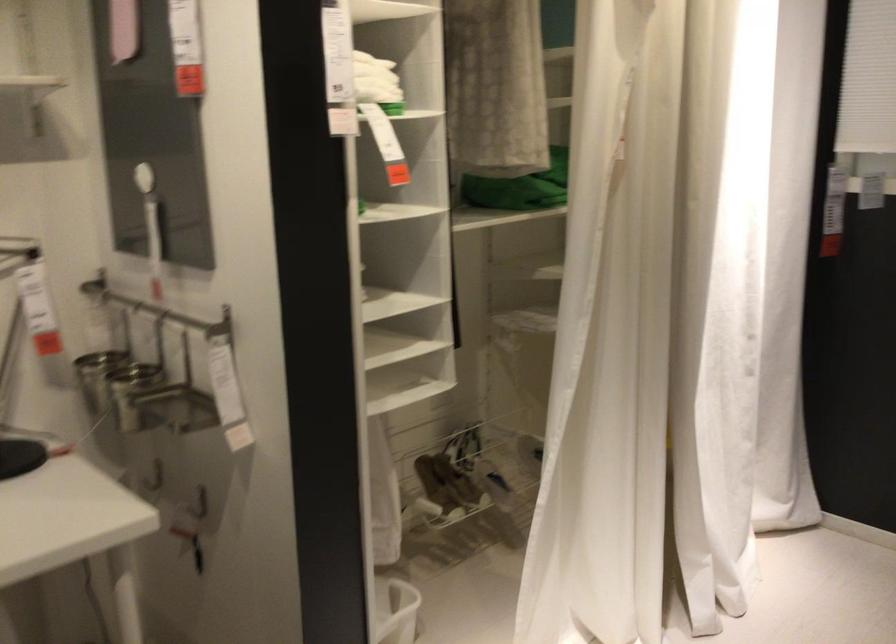
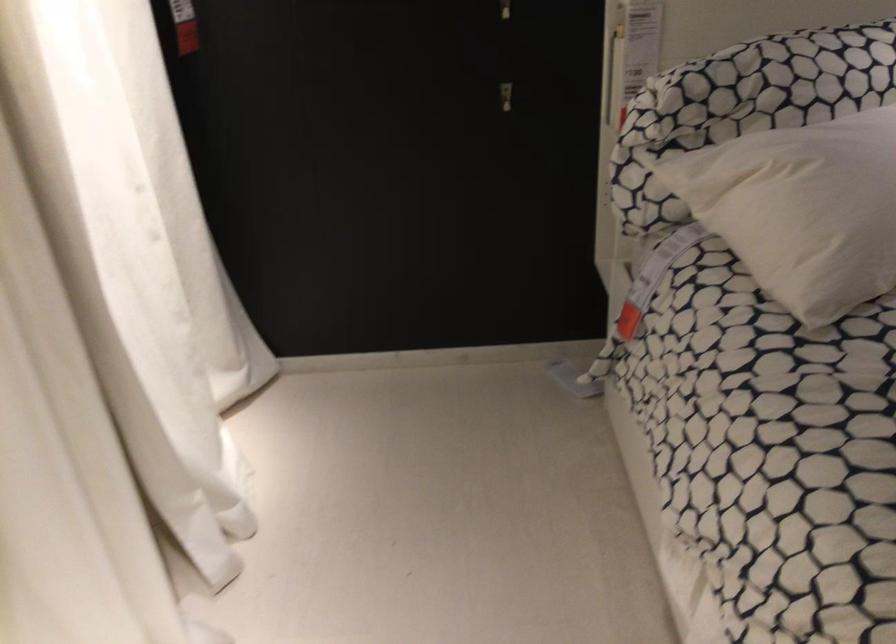
Based on the continuous images, in which direction is the camera rotating?

The camera's rotation is toward right-down.